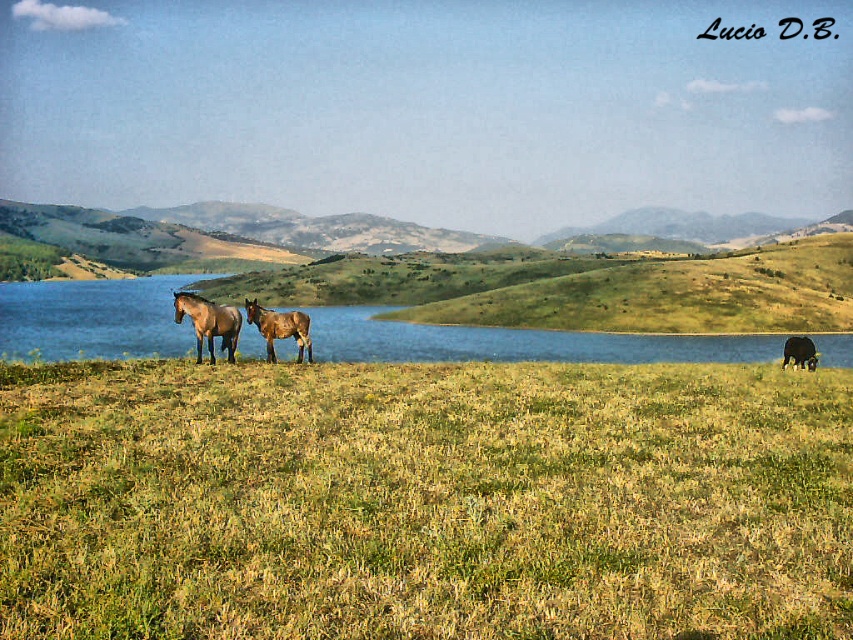
Question: Observing the image, what is the correct spatial positioning of green grassy field at lower center in reference to brown glossy horse at left?

Choices:
 (A) below
 (B) above

Answer: (A)

Question: Among these objects, which one is farthest from the camera?

Choices:
 (A) brown matte horse at center
 (B) brown glossy horse at left

Answer: (A)

Question: Does green grassy field at lower center appear under blue water at center?

Choices:
 (A) yes
 (B) no

Answer: (A)

Question: Which point appears farthest from the camera in this image?

Choices:
 (A) (782, 365)
 (B) (306, 333)
 (C) (67, 461)

Answer: (A)

Question: Where is blue water at center located in relation to brown matte horse at center in the image?

Choices:
 (A) left
 (B) right

Answer: (A)

Question: Which object is the closest to the brown matte horse at center?

Choices:
 (A) brown glossy horse at left
 (B) blue water at center
 (C) green grassy field at lower center
 (D) brown glossy horse at center

Answer: (A)